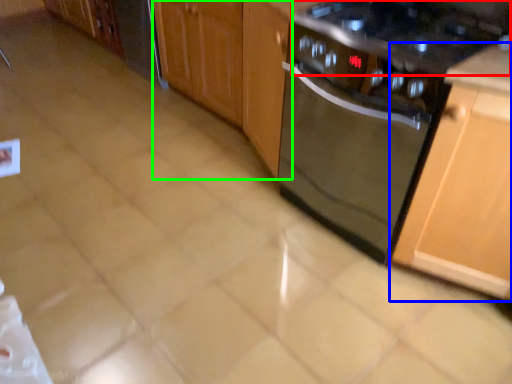
Question: Estimate the real-world distances between objects in this image. Which object is farther from gas stove (highlighted by a red box), cabinetry (highlighted by a blue box) or cabinetry (highlighted by a green box)?

Choices:
 (A) cabinetry
 (B) cabinetry

Answer: (B)